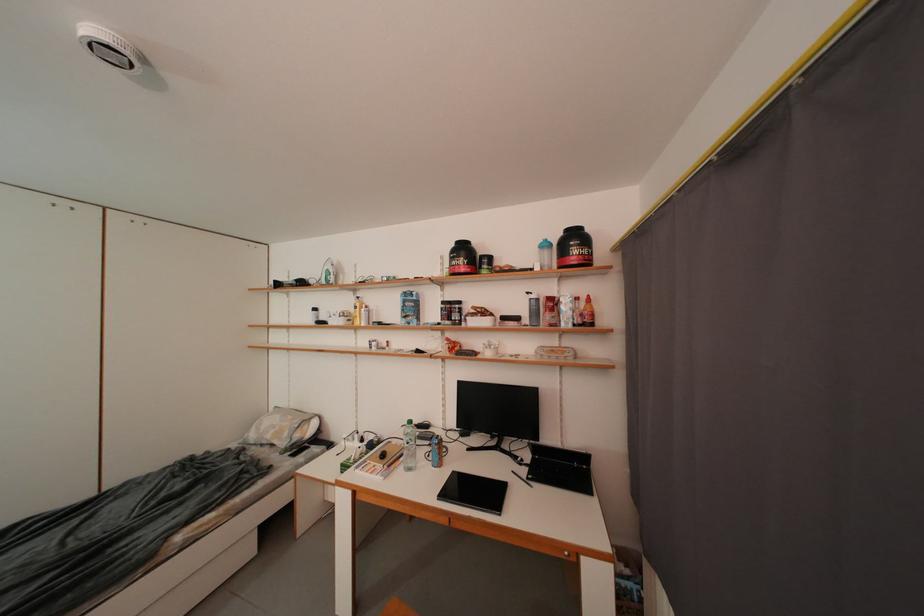
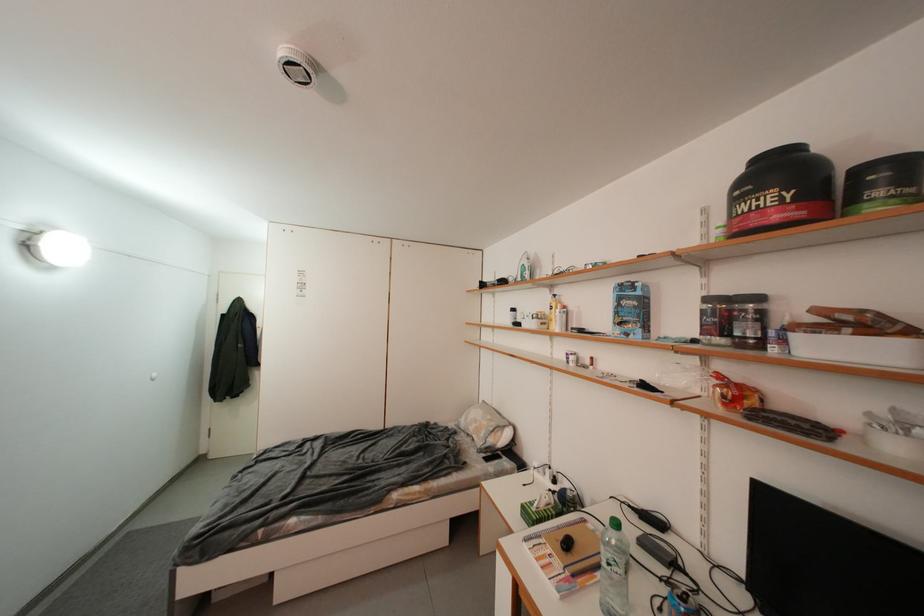
Find the pixel in the second image that matches the point at 467,306 in the first image.

(766, 301)